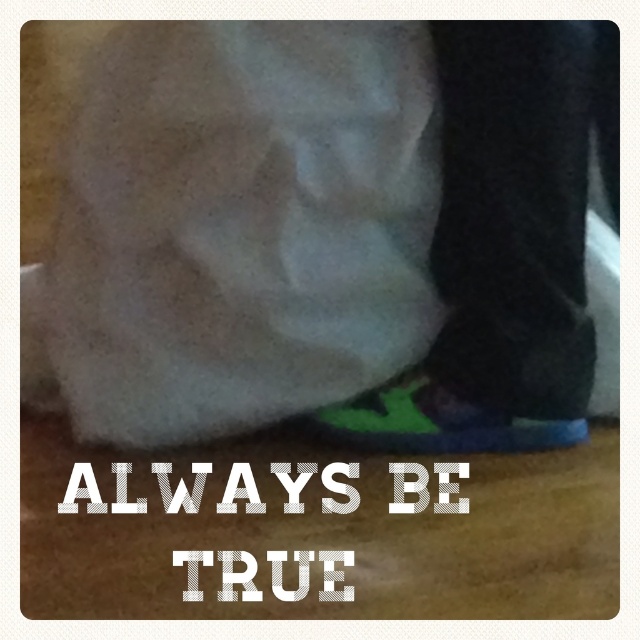
Between green fabric shoe at lower right and green suede shoe at lower center, which one appears on the left side from the viewer's perspective?

Positioned to the left is green suede shoe at lower center.

Does green fabric shoe at lower right appear on the right side of green suede shoe at lower center?

Yes, green fabric shoe at lower right is to the right of green suede shoe at lower center.

Find the location of a particular element. Image resolution: width=640 pixels, height=640 pixels. green fabric shoe at lower right is located at coordinates (506, 244).

Identify the location of green fabric shoe at lower right. This screenshot has height=640, width=640. (506, 244).